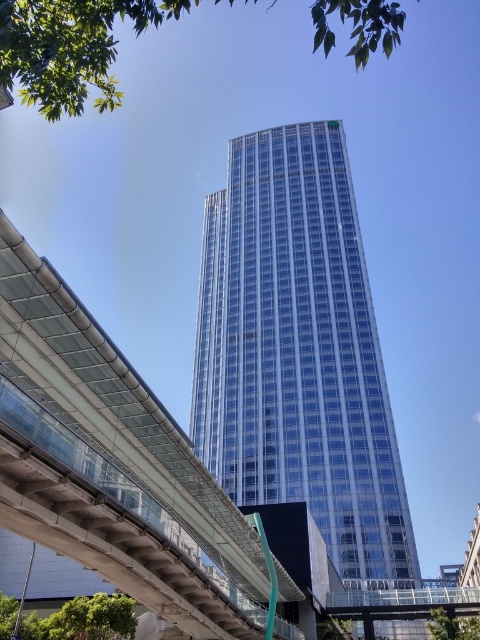
Who is more distant from viewer, [394,458] or [324,627]?

Point [394,458]

Is the position of transparent glass tower at center more distant than that of green leafy tree at lower center?

No, it is in front of green leafy tree at lower center.

Is point (295, 314) closer to camera compared to point (324, 625)?

No, it is not.

This screenshot has height=640, width=480. I want to click on transparent glass tower at center, so click(x=298, y=349).

Who is lower down, green leafy tree at lower left or green leafy tree at lower center?

green leafy tree at lower center

Does point (85, 611) come farther from viewer compared to point (337, 625)?

No, it is in front of (337, 625).

This screenshot has height=640, width=480. I want to click on green leafy tree at lower left, so click(72, 620).

Can you confirm if transparent glass tower at center is thinner than green leafy tree at lower left?

Incorrect, transparent glass tower at center's width is not less than green leafy tree at lower left's.

Between transparent glass tower at center and green leafy tree at lower left, which one is positioned lower?

green leafy tree at lower left is lower down.

Measure the distance between transparent glass tower at center and camera.

A distance of 39.98 meters exists between transparent glass tower at center and camera.

Image resolution: width=480 pixels, height=640 pixels. I want to click on transparent glass tower at center, so click(x=298, y=349).